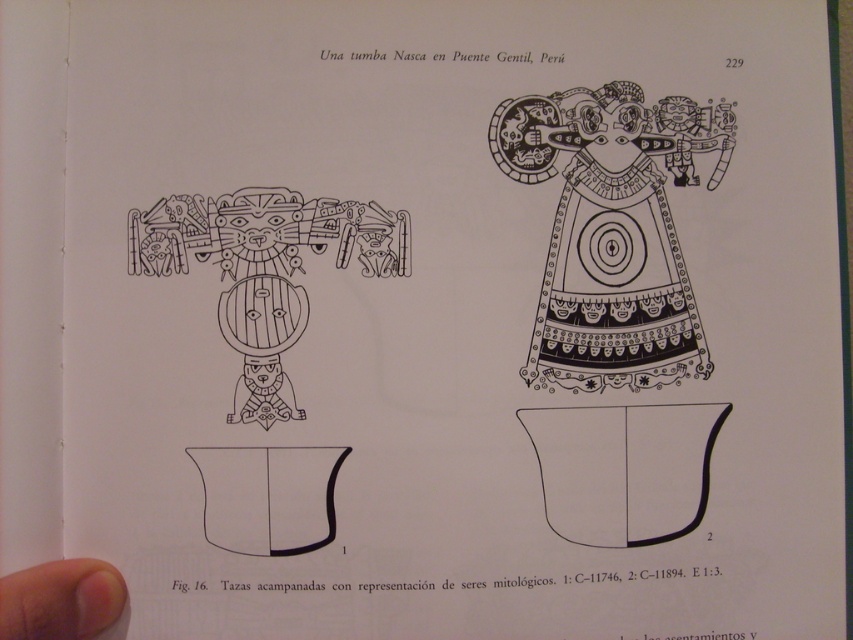
Between black matte dress at center and wooden figure at center, which one is positioned higher?

black matte dress at center is above.

Can you confirm if black matte dress at center is positioned above wooden figure at center?

Yes.

Is point (592, 214) in front of point (260, 282)?

That is False.

At what (x,y) coordinates should I click in order to perform the action: click on black matte dress at center. Please return your answer as a coordinate pair (x, y). Looking at the image, I should click on (614, 285).